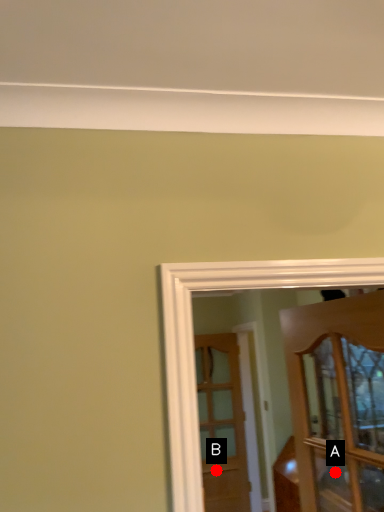
Question: Two points are circled on the image, labeled by A and B beside each circle. Which point appears farthest from the camera in this image?

Choices:
 (A) A is further
 (B) B is further

Answer: (B)